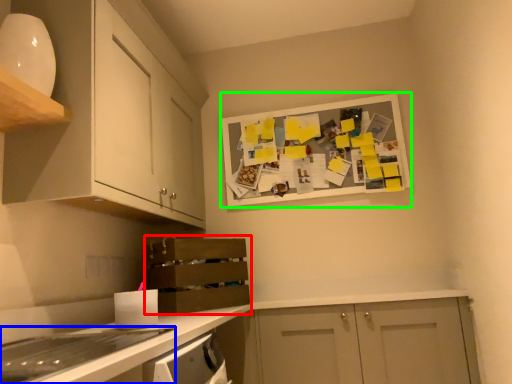
Question: Considering the real-world distances, which object is closest to shelf (highlighted by a red box)? home appliance (highlighted by a blue box) or bulletin board (highlighted by a green box).

Choices:
 (A) home appliance
 (B) bulletin board

Answer: (B)